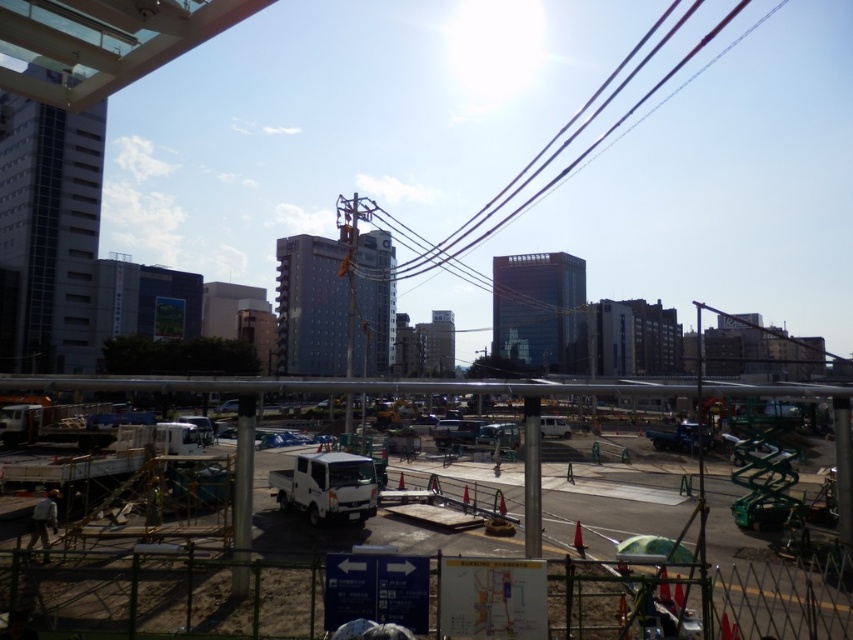
You are a delivery driver arriving at the construction site. You see the white matte truck at center and the black wire at upper center. Which object is located to the left of the other?

The white matte truck at center is positioned on the left side of black wire at upper center.

You are a delivery driver arriving at the construction site and need to park your vehicle. The white matte truck at center is already parked. According to the site map indicated by the blue sign, where should you park your vehicle to avoid blocking the main access route?

The white matte truck at center is located at point (469, 392). Since the blue sign with directional arrows and a map is near the bottom center, you should park your vehicle following the directions on the sign to avoid blocking the main access route.